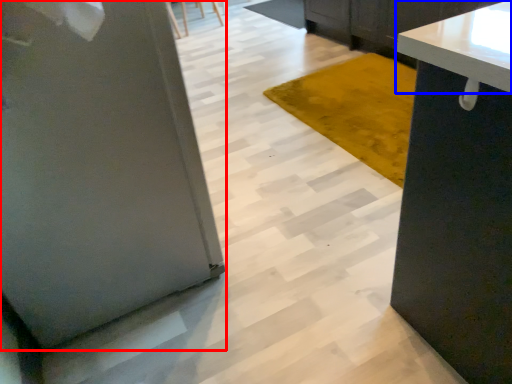
Question: Which object is closer to the camera taking this photo, pillar (highlighted by a red box) or countertop (highlighted by a blue box)?

Choices:
 (A) pillar
 (B) countertop

Answer: (A)